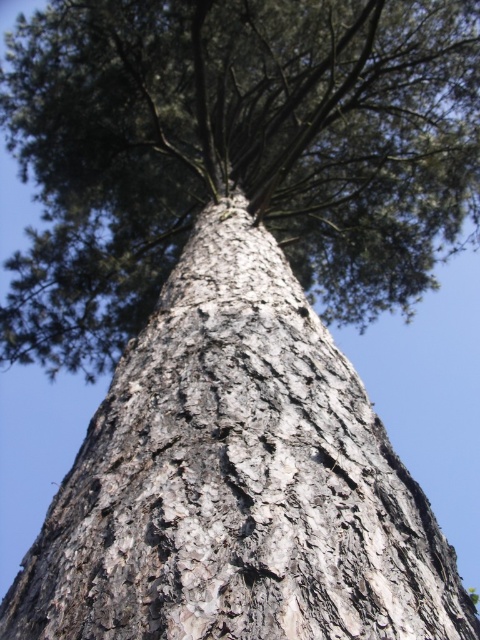
Looking at this image, you are standing at the base of the tree trunk looking upward. There are two points marked on the tree trunk. The first point is at coordinates point (x=166, y=259) and the second is at point (x=108, y=620). Which point is closer to your eyes?

Point (x=108, y=620) is closer to your eyes because it is in front of point (x=166, y=259).

You are a botanist examining the tree trunk and its bark. You notice two distinct bark textures on the tree trunk. Which part of the tree trunk is taller, the smooth bark tree trunk at center or the gray textured bark at center?

The smooth bark tree trunk at center is much taller than the gray textured bark at center according to the description provided.

You are a botanist examining the tree trunk and its bark. Which part of the tree is closer to your eyes when you look at the smooth bark tree trunk at center and the gray textured bark at center?

The smooth bark tree trunk at center is closer to the viewer than the gray textured bark at center.